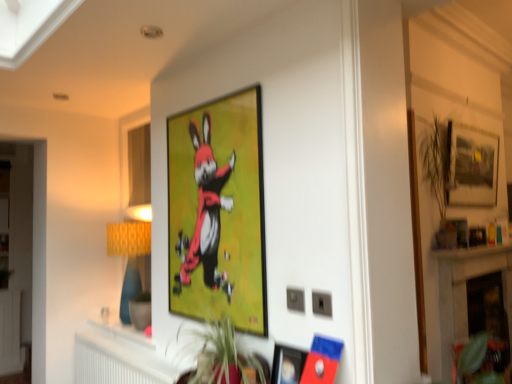
Question: From a real-world perspective, is matte plastic picture frame at lower center, marked as the third picture frame in a back-to-front arrangement, positioned above or below matte black picture frame at upper right, acting as the third picture frame starting from the left?

Choices:
 (A) above
 (B) below

Answer: (B)

Question: From the image's perspective, relative to matte black picture frame at upper right, acting as the third picture frame starting from the left, is matte plastic picture frame at lower center, the 1th picture frame when ordered from front to back, above or below?

Choices:
 (A) above
 (B) below

Answer: (B)

Question: Estimate the real-world distances between objects in this image. Which object is closer to the matte plastic picture frame at lower center, the 1th picture frame when ordered from front to back?

Choices:
 (A) matte black picture frame at upper center, placed as the 2th picture frame when sorted from front to back
 (B) green leafy plant at center, placed as the second plant when sorted from back to front
 (C) yellow fabric lampshade at left
 (D) white marble fireplace at lower right
 (E) green leafy plant at lower right, marked as the 2th plant in a left-to-right arrangement

Answer: (B)

Question: Which of these objects is positioned farthest from the white marble fireplace at lower right?

Choices:
 (A) matte black picture frame at upper right, the 1th picture frame viewed from the right
 (B) white plastic radiator at lower center
 (C) yellow fabric lampshade at left
 (D) green leafy plant at lower right, the 2th plant viewed from the top
 (E) matte black picture frame at upper center, which is the second picture frame from back to front

Answer: (B)